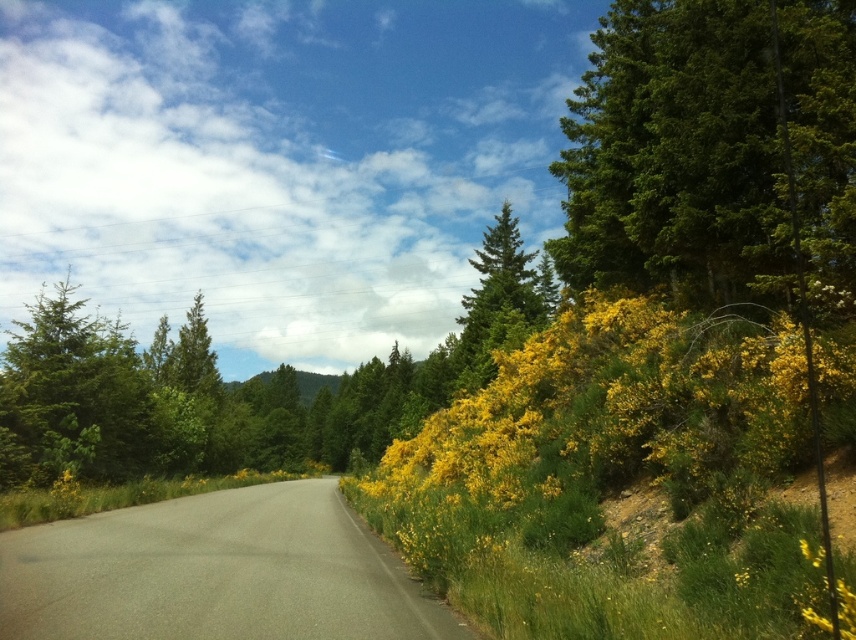
In the scene shown: You are a hiker standing at the center of the rural road scene. You want to take a photo of the green glossy tree at upper right. Where should you position yourself to capture it in the frame?

The green glossy tree at upper right is located at point (676, 156) in the scene. To capture it in your photo, position yourself at the center of the road facing towards the upper right direction where the tree is situated.

You are a hiker standing at the start of the road and want to take a photo of both the green glossy tree at upper right and the green textured pine tree at center. Which tree should you move closer to in order to capture both trees in the same frame?

To capture both the green glossy tree at upper right and the green textured pine tree at center in the same frame, you should move closer to the green glossy tree at upper right since it is smaller than the green textured pine tree at center. This adjustment will help balance their sizes in the photo.